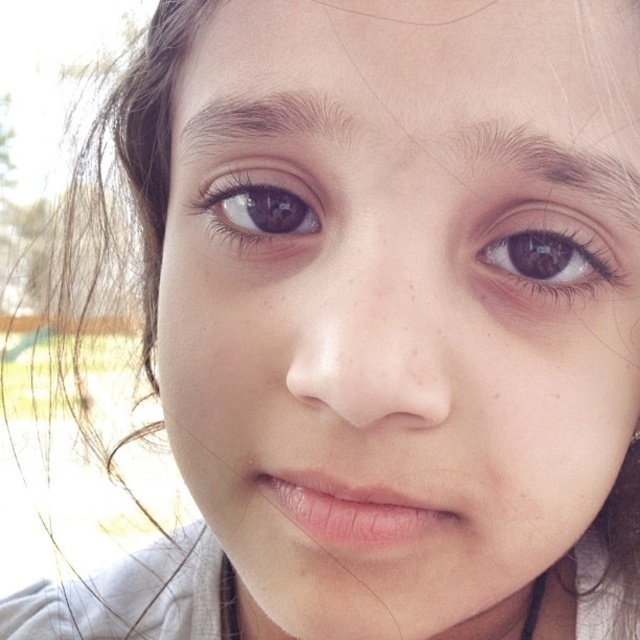
Looking at this image, you are a photographer adjusting your camera settings. You notice a point at coordinates (548, 252) on the image. Based on the scene description, what object does this point most likely correspond to?

The point at coordinates (548, 252) corresponds to the brown matte eye at upper right.

You are a photographer adjusting the focus on your camera. You have two points in the image you need to focus on. The first is at point (531, 288) and the second is at point (538, 132). Since you can only focus on one point at a time, which point should you choose to ensure the other point remains in focus if the depth of field allows for objects behind the focused point to be in focus?

You should focus on point (538, 132) because point (531, 288) is behind it. By focusing on the closer point, the depth of field will include the point behind it, keeping both in focus.

You are a photographer adjusting the focus of your camera. You need to ensure that both the brown matte eye at upper right and the dark brown hair at upper right are in focus. Which object should you adjust the focus on first to accommodate their sizes?

Since the brown matte eye at upper right is smaller than the dark brown hair at upper right, you should focus on the brown matte eye at upper right first to ensure its details are sharp, as smaller objects require more precise focusing to capture their features clearly.